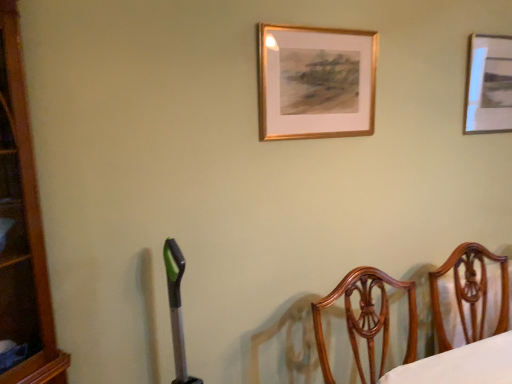
Where is `gold wooden picture frame at upper center, the second picture frame when ordered from back to front`? This screenshot has height=384, width=512. gold wooden picture frame at upper center, the second picture frame when ordered from back to front is located at coordinates (316, 82).

Is metallic silver picture frame at upper right, which ranks as the 1th picture frame in back-to-front order, facing away from gold wooden picture frame at upper center, the 2th picture frame positioned from the right?

metallic silver picture frame at upper right, which ranks as the 1th picture frame in back-to-front order, is not turned away from gold wooden picture frame at upper center, the 2th picture frame positioned from the right.

From the picture: Considering the relative positions of metallic silver picture frame at upper right, which is counted as the second picture frame, starting from the front, and gold wooden picture frame at upper center, the second picture frame when ordered from back to front, in the image provided, is metallic silver picture frame at upper right, which is counted as the second picture frame, starting from the front, behind gold wooden picture frame at upper center, the second picture frame when ordered from back to front,?

Result: Yes, metallic silver picture frame at upper right, which is counted as the second picture frame, starting from the front, is further from the viewer.

Is metallic silver picture frame at upper right, which ranks as the 1th picture frame in back-to-front order, wider than gold wooden picture frame at upper center, the second picture frame when ordered from back to front?

Yes, metallic silver picture frame at upper right, which ranks as the 1th picture frame in back-to-front order, is wider than gold wooden picture frame at upper center, the second picture frame when ordered from back to front.

From the image's perspective, starting from the wooden chair at right, which picture frame is the 2nd one above? Please provide its 2D coordinates.

[(489, 85)]

From a real-world perspective, which is physically above, metallic silver picture frame at upper right, the first picture frame in the right-to-left sequence, or wooden chair at right?

metallic silver picture frame at upper right, the first picture frame in the right-to-left sequence, is physically above.

Which object is further away from the camera taking this photo, metallic silver picture frame at upper right, which ranks as the 1th picture frame in back-to-front order, or wooden chair at right?

metallic silver picture frame at upper right, which ranks as the 1th picture frame in back-to-front order, is more distant.

Considering the sizes of metallic silver picture frame at upper right, which ranks as the 1th picture frame in back-to-front order, and wooden chair at right in the image, is metallic silver picture frame at upper right, which ranks as the 1th picture frame in back-to-front order, wider or thinner than wooden chair at right?

In the image, metallic silver picture frame at upper right, which ranks as the 1th picture frame in back-to-front order, appears to be more narrow than wooden chair at right.

Locate an element on the screen. The width and height of the screenshot is (512, 384). picture frame that appears below the metallic silver picture frame at upper right, which ranks as the 1th picture frame in back-to-front order (from the image's perspective) is located at coordinates (316, 82).

Considering the sizes of gold wooden picture frame at upper center, the second picture frame when ordered from back to front, and metallic silver picture frame at upper right, the first picture frame in the right-to-left sequence, in the image, is gold wooden picture frame at upper center, the second picture frame when ordered from back to front, taller or shorter than metallic silver picture frame at upper right, the first picture frame in the right-to-left sequence,?

Considering their sizes, gold wooden picture frame at upper center, the second picture frame when ordered from back to front, has less height than metallic silver picture frame at upper right, the first picture frame in the right-to-left sequence.

How many degrees apart are the facing directions of gold wooden picture frame at upper center, which appears as the first picture frame when viewed from the front, and metallic silver picture frame at upper right, which is counted as the second picture frame, starting from the front?

The angular difference between gold wooden picture frame at upper center, which appears as the first picture frame when viewed from the front, and metallic silver picture frame at upper right, which is counted as the second picture frame, starting from the front, is 0.124 degrees.

Which is nearer, (328, 44) or (503, 99)?

The point (328, 44) is more forward.

Considering the relative sizes of wooden chair at right and metallic silver picture frame at upper right, which ranks as the 1th picture frame in back-to-front order, in the image provided, is wooden chair at right taller than metallic silver picture frame at upper right, which ranks as the 1th picture frame in back-to-front order,?

Correct, wooden chair at right is much taller as metallic silver picture frame at upper right, which ranks as the 1th picture frame in back-to-front order.

Can you confirm if wooden chair at right is bigger than metallic silver picture frame at upper right, which is counted as the second picture frame, starting from the front?

Yes, wooden chair at right is bigger than metallic silver picture frame at upper right, which is counted as the second picture frame, starting from the front.

Considering the sizes of wooden chair at right and metallic silver picture frame at upper right, which ranks as the 1th picture frame in back-to-front order, in the image, is wooden chair at right wider or thinner than metallic silver picture frame at upper right, which ranks as the 1th picture frame in back-to-front order,?

Considering their sizes, wooden chair at right looks broader than metallic silver picture frame at upper right, which ranks as the 1th picture frame in back-to-front order.

Is wooden chair at right closer to the viewer compared to metallic silver picture frame at upper right, the first picture frame in the right-to-left sequence?

Yes, the depth of wooden chair at right is less than that of metallic silver picture frame at upper right, the first picture frame in the right-to-left sequence.

From a real-world perspective, between gold wooden picture frame at upper center, which appears as the first picture frame when viewed from the front, and wooden chair at right, who is vertically lower?

In real-world perspective, wooden chair at right is lower.

Is gold wooden picture frame at upper center, the 2th picture frame positioned from the right, not within wooden chair at right?

Yes, gold wooden picture frame at upper center, the 2th picture frame positioned from the right, is located beyond the bounds of wooden chair at right.

How different are the orientations of gold wooden picture frame at upper center, the 2th picture frame positioned from the right, and wooden chair at right in degrees?

The facing directions of gold wooden picture frame at upper center, the 2th picture frame positioned from the right, and wooden chair at right are 0.72 degrees apart.

Is gold wooden picture frame at upper center, the 2th picture frame positioned from the right, thinner than wooden chair at right?

Yes, gold wooden picture frame at upper center, the 2th picture frame positioned from the right, is thinner than wooden chair at right.

Consider the image. In terms of width, does wooden chair at right look wider or thinner when compared to gold wooden picture frame at upper center, which appears as the first picture frame when viewed from the front?

In the image, wooden chair at right appears to be wider than gold wooden picture frame at upper center, which appears as the first picture frame when viewed from the front.

From a real-world perspective, which object stands above the other?

gold wooden picture frame at upper center, the 2th picture frame positioned from the right, from a real-world perspective.

Identify the location of picture frame positioned vertically above the gold wooden picture frame at upper center, the second picture frame when ordered from back to front (from a real-world perspective). This screenshot has height=384, width=512. (489, 85).

Find the location of `picture frame on the right of the wooden chair at right`. picture frame on the right of the wooden chair at right is located at coordinates (489, 85).

When comparing their distances from wooden chair at right, does gold wooden picture frame at upper center, which appears as the first picture frame when viewed from the front, or metallic silver picture frame at upper right, which ranks as the 1th picture frame in back-to-front order, seem further?

Based on the image, gold wooden picture frame at upper center, which appears as the first picture frame when viewed from the front, appears to be further to wooden chair at right.

Looking at the image, which one is located closer to gold wooden picture frame at upper center, the second picture frame when ordered from back to front, metallic silver picture frame at upper right, the first picture frame in the right-to-left sequence, or wooden chair at right?

metallic silver picture frame at upper right, the first picture frame in the right-to-left sequence, lies closer to gold wooden picture frame at upper center, the second picture frame when ordered from back to front, than the other object.

Considering their positions, is wooden chair at right positioned closer to metallic silver picture frame at upper right, the second picture frame viewed from the left, than gold wooden picture frame at upper center, acting as the first picture frame starting from the left?

Among the two, gold wooden picture frame at upper center, acting as the first picture frame starting from the left, is located nearer to metallic silver picture frame at upper right, the second picture frame viewed from the left.

Estimate the real-world distances between objects in this image. Which object is closer to wooden chair at right, metallic silver picture frame at upper right, the second picture frame viewed from the left, or gold wooden picture frame at upper center, acting as the first picture frame starting from the left?

Based on the image, metallic silver picture frame at upper right, the second picture frame viewed from the left, appears to be nearer to wooden chair at right.

Looking at the image, which one is located further to metallic silver picture frame at upper right, which ranks as the 1th picture frame in back-to-front order, gold wooden picture frame at upper center, the 2th picture frame positioned from the right, or wooden chair at right?

wooden chair at right is further to metallic silver picture frame at upper right, which ranks as the 1th picture frame in back-to-front order.

Looking at the image, which one is located further to gold wooden picture frame at upper center, the 2th picture frame positioned from the right, wooden chair at right or metallic silver picture frame at upper right, which is counted as the second picture frame, starting from the front?

wooden chair at right.

The width and height of the screenshot is (512, 384). I want to click on picture frame between metallic silver picture frame at upper right, which ranks as the 1th picture frame in back-to-front order, and wooden chair at right vertically, so click(316, 82).